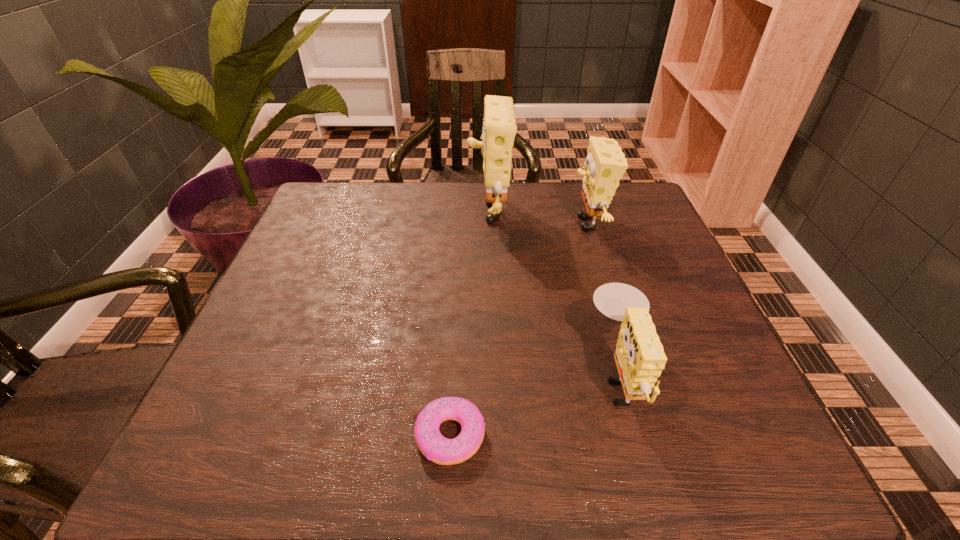
At what (x,y) coordinates should I click in order to perform the action: click on blank space located on the face of the second shortest sponge. Please return your answer as a coordinate pair (x, y). This screenshot has height=540, width=960. Looking at the image, I should click on (435, 223).

Find the location of a particular element. free spot located on the face of the second shortest sponge is located at coordinates (481, 223).

Where is `free space located 0.140m on the front-facing side of the second shortest object`? This screenshot has height=540, width=960. free space located 0.140m on the front-facing side of the second shortest object is located at coordinates (515, 375).

The width and height of the screenshot is (960, 540). I want to click on vacant position located 0.260m on the front-facing side of the second shortest object, so click(x=447, y=375).

This screenshot has height=540, width=960. In order to click on free space located on the front-facing side of the second shortest object in this screenshot , I will do `click(469, 375)`.

Locate an element on the screen. vacant space located on the right of the shortest object is located at coordinates (565, 435).

This screenshot has width=960, height=540. I want to click on sponge at the near edge, so click(639, 356).

Identify the location of doughnut that is at the near edge. This screenshot has height=540, width=960. (432, 444).

Where is `object that is at the right edge`? object that is at the right edge is located at coordinates (605, 164).

You are a GUI agent. You are given a task and a screenshot of the screen. Output one action in this format:
    pyautogui.click(x=<x>, y=<y>)
    Task: Click on the object that is at the far right corner
    
    Given the screenshot: What is the action you would take?
    point(605,164)